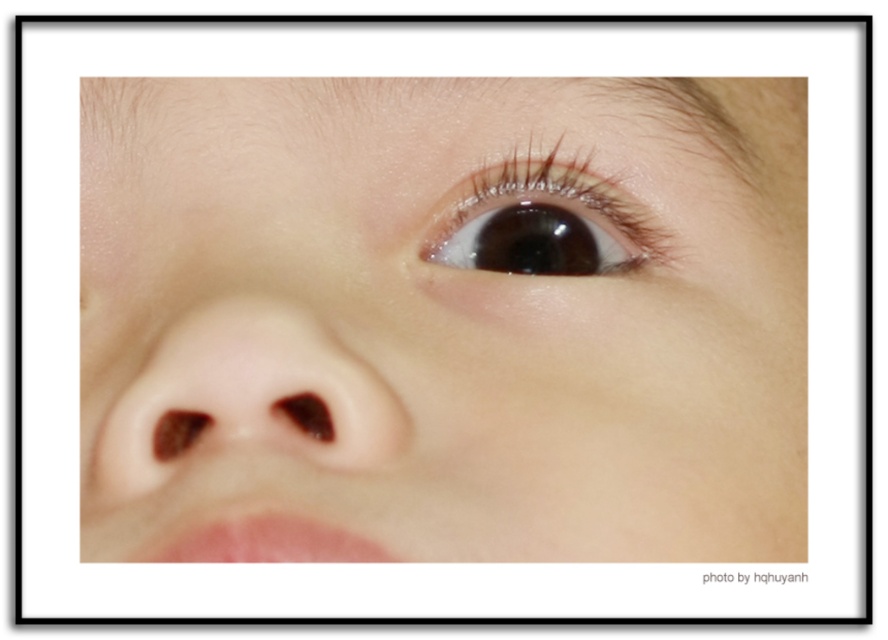
Question: Among these objects, which one is nearest to the camera?

Choices:
 (A) smooth skin eye at upper center
 (B) glossy brown eye at upper center
 (C) smooth flesh-colored nose at center

Answer: (A)

Question: Which object is positioned farthest from the glossy brown eye at upper center?

Choices:
 (A) smooth flesh-colored nose at center
 (B) smooth skin eye at upper center

Answer: (A)

Question: Which point appears closest to the camera in this image?

Choices:
 (A) (227, 305)
 (B) (521, 168)

Answer: (A)

Question: Can you confirm if smooth flesh-colored nose at center is wider than glossy brown eye at upper center?

Choices:
 (A) no
 (B) yes

Answer: (B)

Question: Does smooth skin eye at upper center have a greater width compared to smooth flesh-colored nose at center?

Choices:
 (A) no
 (B) yes

Answer: (B)

Question: Is smooth flesh-colored nose at center to the right of glossy brown eye at upper center from the viewer's perspective?

Choices:
 (A) yes
 (B) no

Answer: (B)